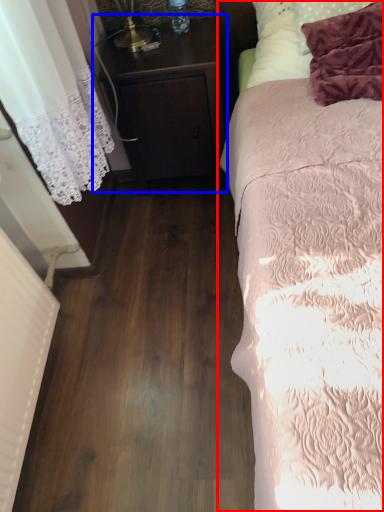
Question: Among these objects, which one is nearest to the camera, bed (highlighted by a red box) or nightstand (highlighted by a blue box)?

Choices:
 (A) bed
 (B) nightstand

Answer: (A)